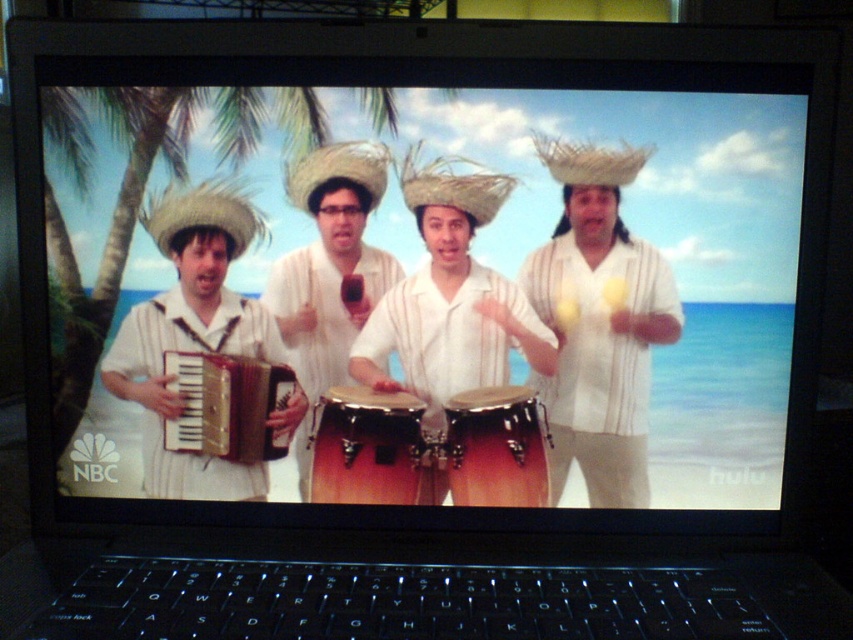
Does white striped shirt at center come in front of brown wooden drum at center?

Yes, white striped shirt at center is in front of brown wooden drum at center.

In the scene shown: Can you confirm if white striped shirt at center is shorter than brown wooden drum at center?

No, white striped shirt at center is not shorter than brown wooden drum at center.

The width and height of the screenshot is (853, 640). Describe the element at coordinates (599, 324) in the screenshot. I see `white striped shirt at center` at that location.

The height and width of the screenshot is (640, 853). What are the coordinates of `white striped shirt at center` in the screenshot? It's located at (599, 324).

Is matte white shirt at left shorter than gold metallic accordion at left?

Incorrect, matte white shirt at left's height does not fall short of gold metallic accordion at left's.

Who is shorter, matte white shirt at left or gold metallic accordion at left?

gold metallic accordion at left

Where is `matte white shirt at left`? matte white shirt at left is located at coordinates (192, 333).

Does matte white shirt at center appear on the left side of gold metallic accordion at left?

Incorrect, matte white shirt at center is not on the left side of gold metallic accordion at left.

The image size is (853, 640). Find the location of `matte white shirt at center`. matte white shirt at center is located at coordinates (331, 260).

At what (x,y) coordinates should I click in order to perform the action: click on matte white shirt at center. Please return your answer as a coordinate pair (x, y). This screenshot has width=853, height=640. Looking at the image, I should click on (331, 260).